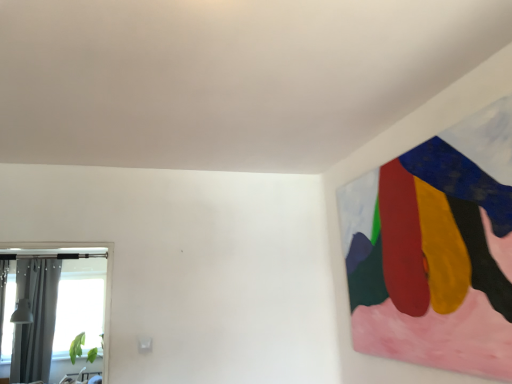
The width and height of the screenshot is (512, 384). Describe the element at coordinates (7, 306) in the screenshot. I see `clear glass window at left` at that location.

I want to click on clear glass window at left, so click(x=7, y=306).

This screenshot has height=384, width=512. What do you see at coordinates (35, 319) in the screenshot? I see `gray fabric curtain at left` at bounding box center [35, 319].

You are a GUI agent. You are given a task and a screenshot of the screen. Output one action in this format:
    pyautogui.click(x=<x>, y=<y>)
    Task: Click on the gray fabric curtain at left
    The image size is (512, 384).
    Given the screenshot: What is the action you would take?
    pyautogui.click(x=35, y=319)

This screenshot has height=384, width=512. What are the coordinates of `clear glass window at left` in the screenshot? It's located at (7, 306).

From the picture: Between clear glass window at left and gray fabric curtain at left, which one appears on the left side from the viewer's perspective?

Positioned to the left is clear glass window at left.

Is clear glass window at left in front of or behind gray fabric curtain at left in the image?

clear glass window at left is positioned closer to the viewer than gray fabric curtain at left.

Is point (13, 270) closer to camera compared to point (17, 334)?

Yes, it is.

From the image's perspective, is clear glass window at left located above or below gray fabric curtain at left?

Clearly, from the image's perspective, clear glass window at left is above gray fabric curtain at left.

From a real-world perspective, is clear glass window at left beneath gray fabric curtain at left?

Actually, clear glass window at left is physically above gray fabric curtain at left in the real world.

In terms of width, does clear glass window at left look wider or thinner when compared to gray fabric curtain at left?

Considering their sizes, clear glass window at left looks broader than gray fabric curtain at left.

Can you confirm if clear glass window at left is shorter than gray fabric curtain at left?

Yes, clear glass window at left is shorter than gray fabric curtain at left.

Considering the relative sizes of clear glass window at left and gray fabric curtain at left in the image provided, is clear glass window at left smaller than gray fabric curtain at left?

Correct, clear glass window at left occupies less space than gray fabric curtain at left.

Is gray fabric curtain at left surrounded by clear glass window at left?

No, gray fabric curtain at left is not a part of clear glass window at left.

Are clear glass window at left and gray fabric curtain at left located far from each other?

No, clear glass window at left is not far away from gray fabric curtain at left.

From the picture: Is gray fabric curtain at left at the back of clear glass window at left?

No, clear glass window at left's orientation is not away from gray fabric curtain at left.

Measure the distance from clear glass window at left to gray fabric curtain at left.

clear glass window at left and gray fabric curtain at left are 5.21 inches apart from each other.

The height and width of the screenshot is (384, 512). Find the location of `window on the left of the gray fabric curtain at left`. window on the left of the gray fabric curtain at left is located at coordinates (7, 306).

Would you say gray fabric curtain at left is to the left or to the right of clear glass window at left in the picture?

Clearly, gray fabric curtain at left is on the right of clear glass window at left in the image.

Which object is closer to the camera, gray fabric curtain at left or clear glass window at left?

Positioned in front is clear glass window at left.

Considering the positions of point (45, 265) and point (13, 296), is point (45, 265) closer or farther from the camera than point (13, 296)?

Point (45, 265) is farther from the camera than point (13, 296).

From the image's perspective, is gray fabric curtain at left located above or below clear glass window at left?

gray fabric curtain at left is below clear glass window at left.

From a real-world perspective, is gray fabric curtain at left located beneath clear glass window at left?

Indeed, from a real-world perspective, gray fabric curtain at left is positioned beneath clear glass window at left.

Considering the relative sizes of gray fabric curtain at left and clear glass window at left in the image provided, is gray fabric curtain at left thinner than clear glass window at left?

Yes.

Considering the sizes of objects gray fabric curtain at left and clear glass window at left in the image provided, who is taller, gray fabric curtain at left or clear glass window at left?

gray fabric curtain at left is taller.

Which of these two, gray fabric curtain at left or clear glass window at left, is smaller?

Smaller between the two is clear glass window at left.

Is gray fabric curtain at left inside or outside of clear glass window at left?

gray fabric curtain at left is spatially situated outside clear glass window at left.

Are gray fabric curtain at left and clear glass window at left far apart?

No, gray fabric curtain at left is not far away from clear glass window at left.

Is gray fabric curtain at left turned away from clear glass window at left?

No, gray fabric curtain at left is not facing away from clear glass window at left.

The height and width of the screenshot is (384, 512). What are the coordinates of `curtain located underneath the clear glass window at left (from a real-world perspective)` in the screenshot? It's located at (35, 319).

The height and width of the screenshot is (384, 512). I want to click on curtain below the clear glass window at left (from a real-world perspective), so click(x=35, y=319).

The width and height of the screenshot is (512, 384). What are the coordinates of `window above the gray fabric curtain at left (from a real-world perspective)` in the screenshot? It's located at (7, 306).